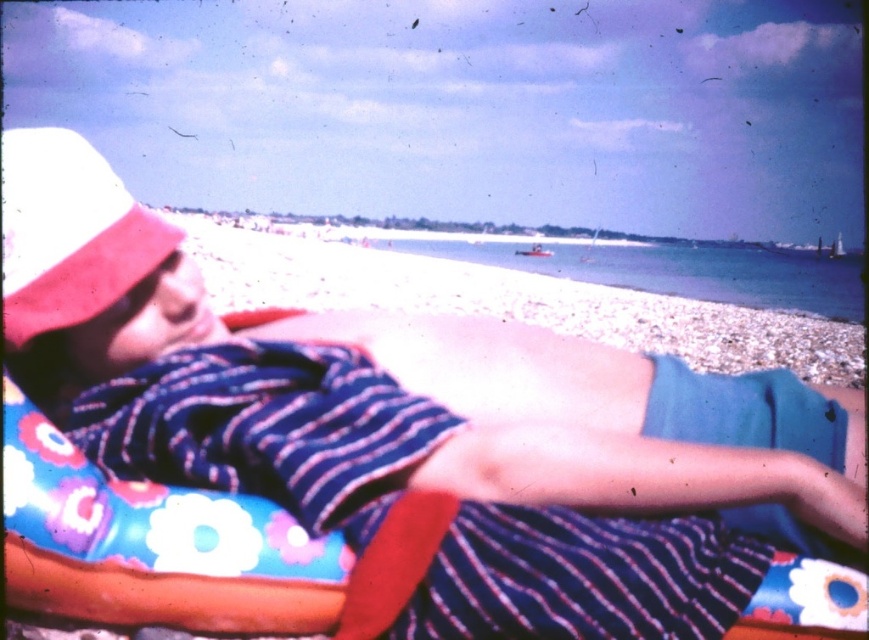
Question: Does white sand at center have a smaller size compared to pink fabric hat at upper left?

Choices:
 (A) yes
 (B) no

Answer: (B)

Question: Is white sand at center to the left of pink fabric hat at upper left from the viewer's perspective?

Choices:
 (A) yes
 (B) no

Answer: (B)

Question: Is white sand at center thinner than pink fabric hat at upper left?

Choices:
 (A) no
 (B) yes

Answer: (A)

Question: Which of the following is the closest to the observer?

Choices:
 (A) pink fabric hat at upper left
 (B) white sand at center

Answer: (A)

Question: Which object appears farthest from the camera in this image?

Choices:
 (A) pink fabric hat at upper left
 (B) white sand at center

Answer: (B)